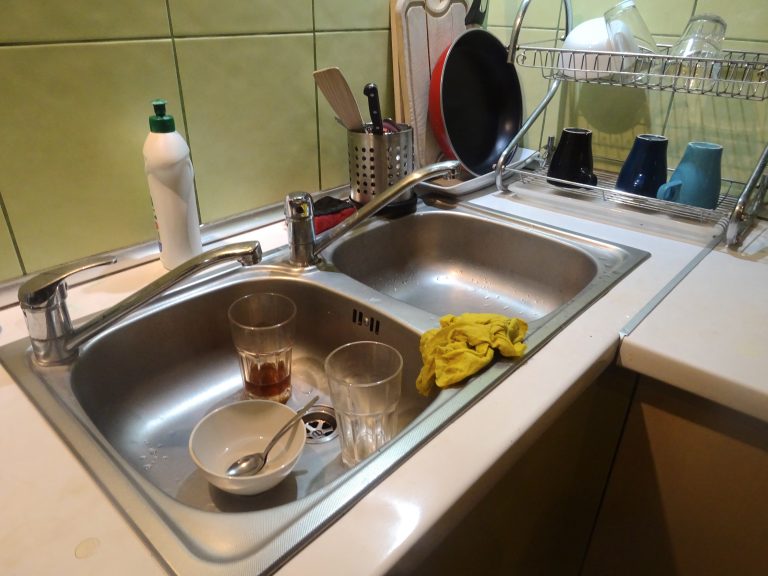
Where is `utensil`? The height and width of the screenshot is (576, 768). utensil is located at coordinates (242, 467), (376, 118), (343, 104).